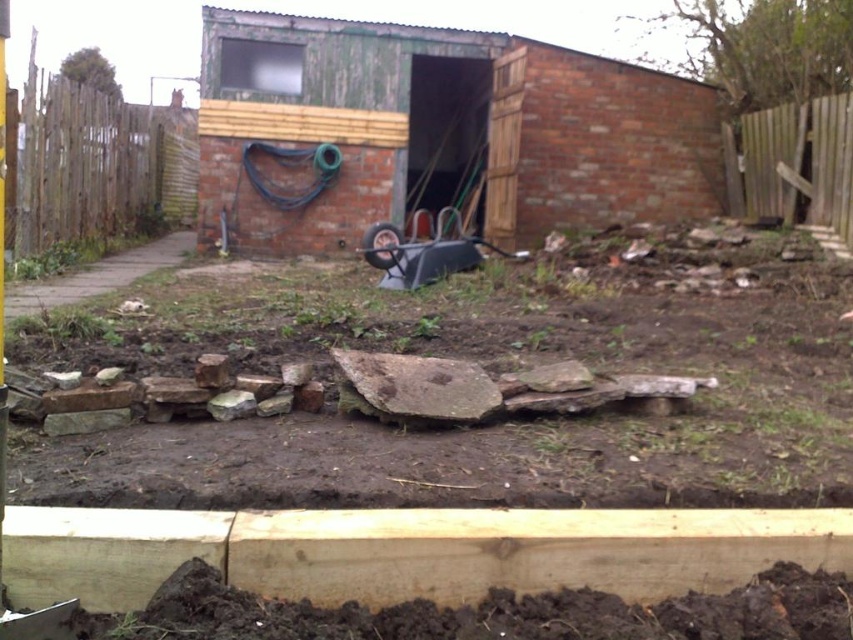
Can you confirm if green weathered shed at center is positioned above wooden fence at right?

Correct, green weathered shed at center is located above wooden fence at right.

Does green weathered shed at center have a greater width compared to wooden fence at right?

Yes.

Is point (397, 116) behind point (809, 124)?

Yes.

At what (x,y) coordinates should I click in order to perform the action: click on green weathered shed at center. Please return your answer as a coordinate pair (x, y). The height and width of the screenshot is (640, 853). Looking at the image, I should click on (444, 131).

What do you see at coordinates (444, 131) in the screenshot? I see `green weathered shed at center` at bounding box center [444, 131].

Who is more distant from viewer, (312, 115) or (33, 173)?

The point (312, 115) is behind.

Where is `green weathered shed at center`? green weathered shed at center is located at coordinates (444, 131).

Can you confirm if wooden fence at left is smaller than wooden fence at right?

Incorrect, wooden fence at left is not smaller in size than wooden fence at right.

Which is more to the right, wooden fence at left or wooden fence at right?

From the viewer's perspective, wooden fence at right appears more on the right side.

The image size is (853, 640). I want to click on wooden fence at left, so click(96, 168).

You are a GUI agent. You are given a task and a screenshot of the screen. Output one action in this format:
    pyautogui.click(x=<x>, y=<y>)
    Task: Click on the wooden fence at left
    This screenshot has width=853, height=640.
    Given the screenshot: What is the action you would take?
    96,168